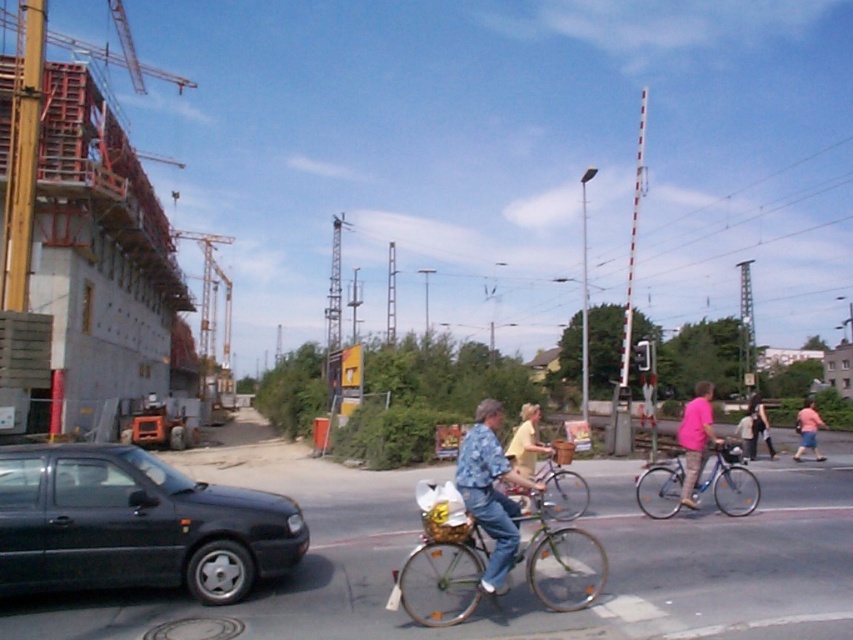
Question: Can you confirm if green matte bicycle at center is wider than metallic silver bicycle at center?

Choices:
 (A) no
 (B) yes

Answer: (B)

Question: Does matte black car at left appear under shiny silver bicycle at center?

Choices:
 (A) no
 (B) yes

Answer: (A)

Question: Which of the following is the closest to the observer?

Choices:
 (A) (552, 570)
 (B) (486, 522)
 (C) (807, 428)
 (D) (711, 413)

Answer: (B)

Question: Based on their relative distances, which object is nearer to the pink cotton shirt at right?

Choices:
 (A) denim jeans at center
 (B) matte black car at left

Answer: (A)

Question: Which object is the closest to the metallic silver bicycle at center?

Choices:
 (A) denim jeans at center
 (B) pink cotton shirt at right
 (C) shiny silver bicycle at center
 (D) matte black car at left

Answer: (C)

Question: Does green matte bicycle at center have a lesser width compared to metallic silver bicycle at center?

Choices:
 (A) no
 (B) yes

Answer: (A)